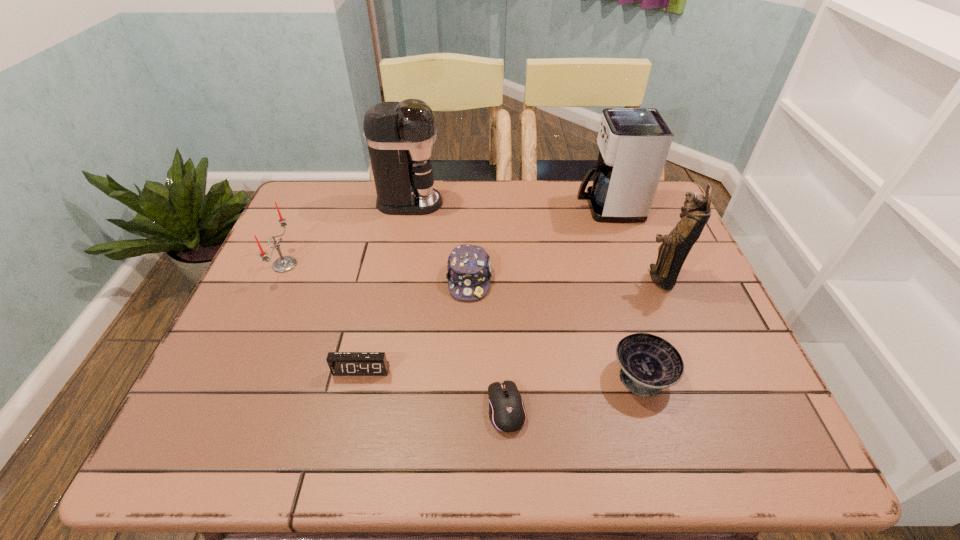
This screenshot has width=960, height=540. Find the location of `vacant space that satisfies the following two spatial constraints: 1. on the front-facing side of the figurine; 2. on the front-facing side of the alarm clock`. vacant space that satisfies the following two spatial constraints: 1. on the front-facing side of the figurine; 2. on the front-facing side of the alarm clock is located at coordinates (697, 370).